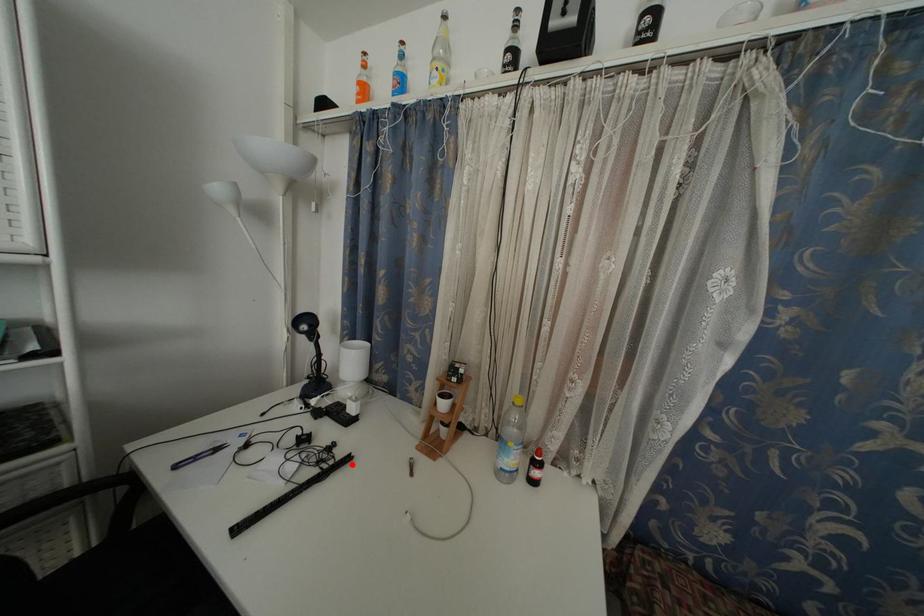
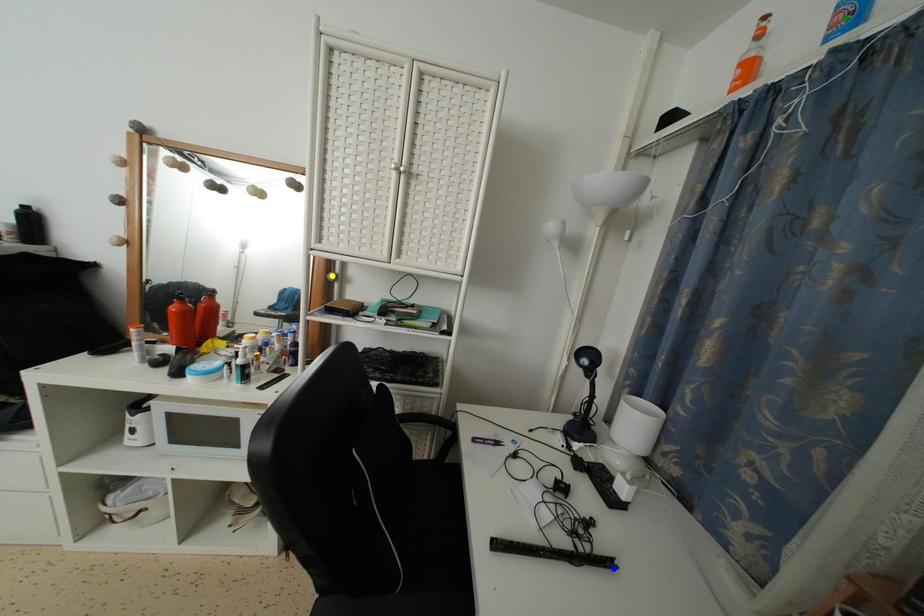
Question: I am providing you with two images of the same scene from different viewpoints. A red point is marked on the first image. You are given multiple points on the second image. Which point in image 2 is actually the same real-world point as the red point in image 1?

Choices:
 (A) yellow point
 (B) green point
 (C) blue point

Answer: (C)